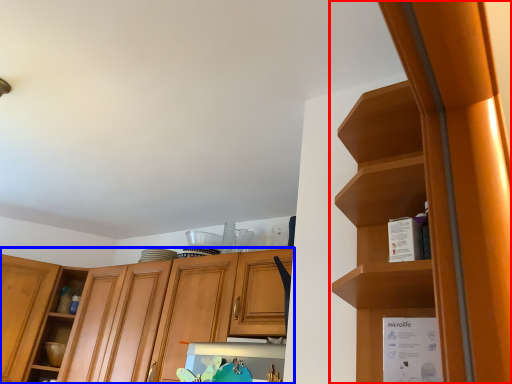
Question: Which object appears farthest to the camera in this image, cabinetry (highlighted by a red box) or cabinetry (highlighted by a blue box)?

Choices:
 (A) cabinetry
 (B) cabinetry

Answer: (B)